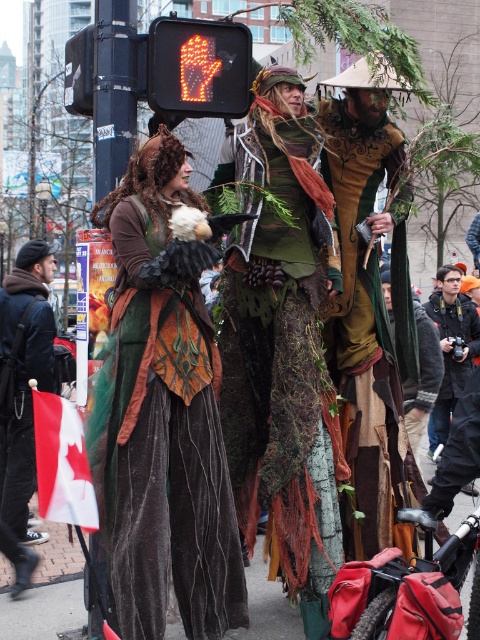
Which of these two, green textured fabric at center or green velvet dress at center, stands taller?

Standing taller between the two is green textured fabric at center.

Between green textured fabric at center and green velvet dress at center, which one is positioned lower?

green textured fabric at center is lower down.

Does point (286, 312) lie behind point (335, 177)?

No, (286, 312) is in front of (335, 177).

This screenshot has width=480, height=640. Find the location of `green textured fabric at center`. green textured fabric at center is located at coordinates (280, 339).

Who is positioned more to the left, velvet/green dress at center or green textured fabric at center?

velvet/green dress at center is more to the left.

Between velvet/green dress at center and green textured fabric at center, which one has more height?

With more height is green textured fabric at center.

Which is in front, point (110, 508) or point (263, 348)?

Point (110, 508) is in front.

Where is `velvet/green dress at center`? velvet/green dress at center is located at coordinates (163, 444).

Is velvet/green dress at center smaller than orange led hand at upper center?

No, velvet/green dress at center is not smaller than orange led hand at upper center.

Does velvet/green dress at center have a larger size compared to orange led hand at upper center?

Correct, velvet/green dress at center is larger in size than orange led hand at upper center.

Is point (216, 620) less distant than point (192, 77)?

Yes, point (216, 620) is closer to viewer.

The image size is (480, 640). I want to click on velvet/green dress at center, so click(163, 444).